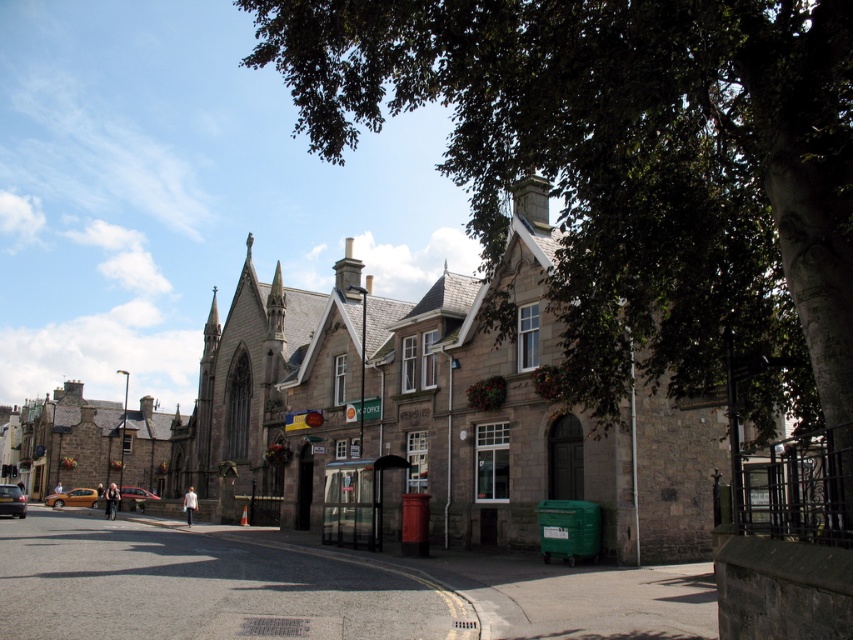
You are a pedestrian standing at the bus stop shelter. You need to cross the street to reach the Post Office entrance. There are two cars parked at the lower left corner of your view. The orange metallic car at lower left and the matte black car at lower left. Which car is closer to you as you stand at the bus stop?

The distance between the orange metallic car at lower left and the matte black car at lower left is 74.72 meters. Since you are at the bus stop shelter, the car closer to you would depend on their positions relative to the shelter. However, the description only specifies the distance between them, not their individual distances from the shelter. Therefore, it is impossible to determine which car is closer to you based on the provided information.

You are a pedestrian standing at the bus stop shelter and want to cross the street. You see a matte black car at lower left and a metallic silver car at lower left. Which car is closer to you?

The matte black car at lower left is closer to you because it is in front of the metallic silver car at lower left.

You are a delivery person trying to park your van between the orange metallic car at lower left and the metallic silver car at lower left. Based on their heights, can you safely stack your van on top of them without exceeding the height limit?

The orange metallic car at lower left is not as tall as metallic silver car at lower left. Since the orange metallic car at lower left is shorter, stacking your van on top of them may exceed the height limit depending on the combined height. Check local regulations for maximum allowed vehicle height when stacked.